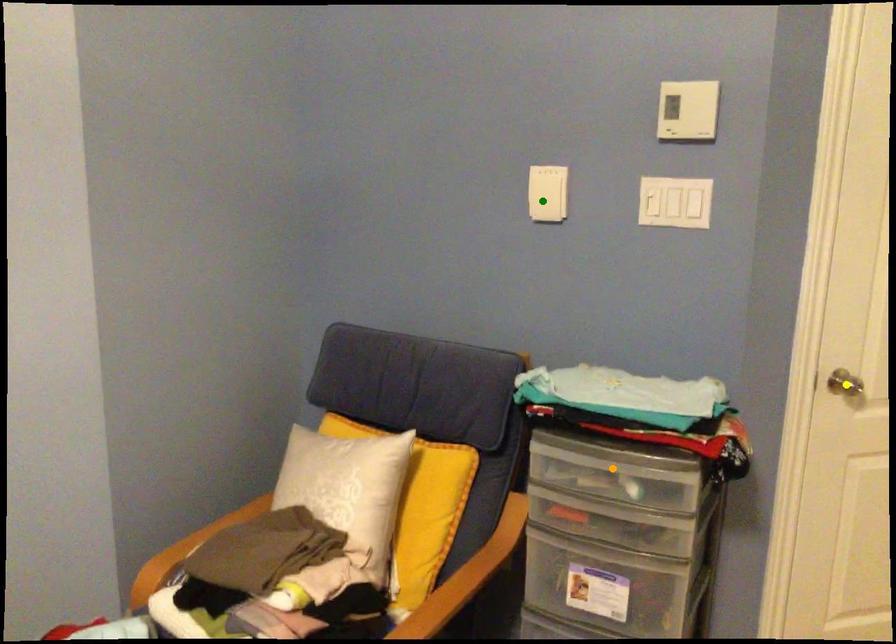
Order these from nearest to farthest:
1. orange point
2. yellow point
3. green point

orange point
yellow point
green point